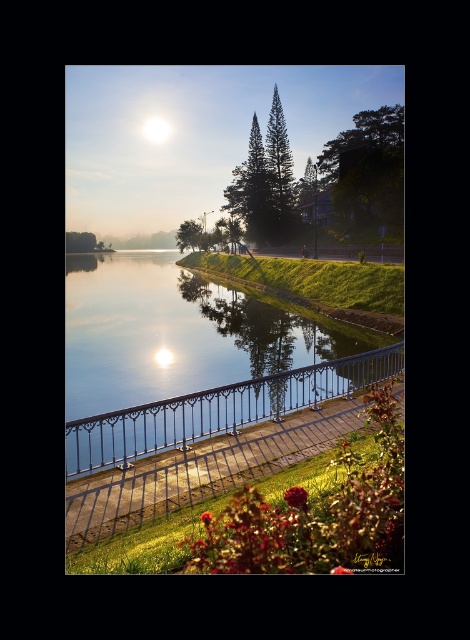
Question: Is black wrought iron railing at lower center to the left of white glossy moonlight at upper center from the viewer's perspective?

Choices:
 (A) yes
 (B) no

Answer: (B)

Question: Does black wrought iron railing at lower center have a larger size compared to white glossy moonlight at upper center?

Choices:
 (A) no
 (B) yes

Answer: (A)

Question: Can you confirm if black wrought iron railing at lower center is positioned to the left of white glossy moonlight at upper center?

Choices:
 (A) yes
 (B) no

Answer: (B)

Question: Among these points, which one is farthest from the camera?

Choices:
 (A) (110, 465)
 (B) (161, 132)

Answer: (B)

Question: Among these points, which one is farthest from the camera?

Choices:
 (A) (259, 396)
 (B) (170, 132)

Answer: (B)